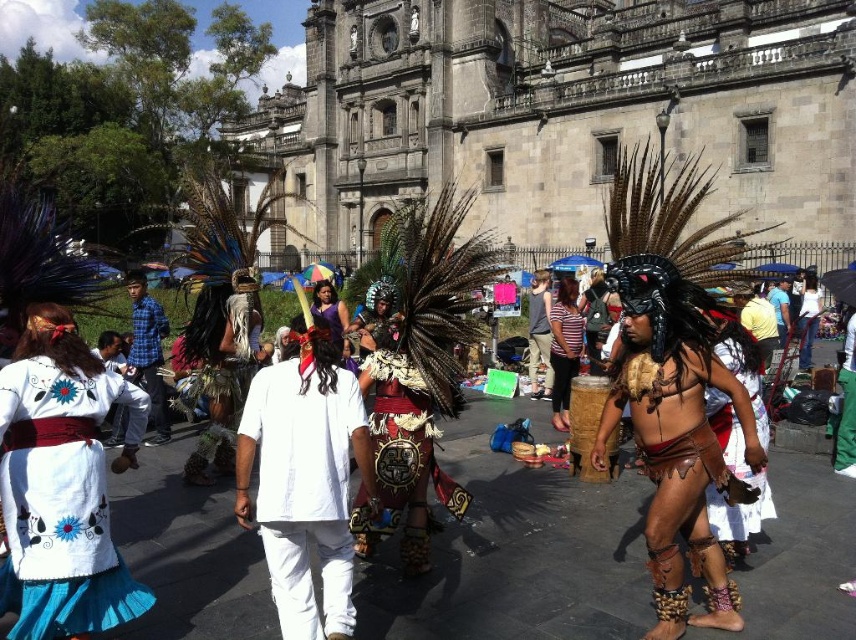
You are a photographer trying to capture a group photo of the two people wearing the white cotton shirt at center and blue plaid shirt at center. Since you want to ensure both shirts are clearly visible in the photo, which shirt should you focus on first to avoid blurring due to their thickness?

The white cotton shirt at center is thinner than the blue plaid shirt at center, so you should focus on the blue plaid shirt at center first to ensure it remains sharp in the photo.